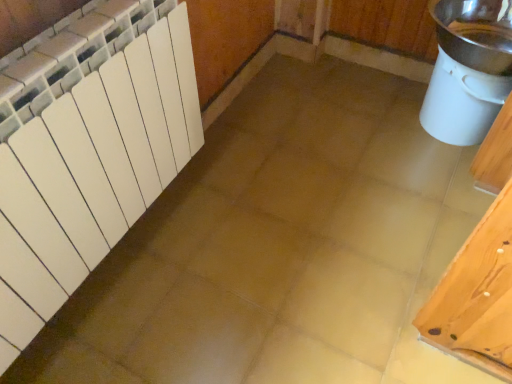
Question: In terms of height, does white matte radiator at left look taller or shorter compared to white plastic bucket at right?

Choices:
 (A) tall
 (B) short

Answer: (A)

Question: Is white matte radiator at left bigger or smaller than white plastic bucket at right?

Choices:
 (A) small
 (B) big

Answer: (B)

Question: From a real-world perspective, relative to white plastic bucket at right, is white matte radiator at left vertically above or below?

Choices:
 (A) above
 (B) below

Answer: (A)

Question: From the image's perspective, is white plastic bucket at right located above or below white matte radiator at left?

Choices:
 (A) below
 (B) above

Answer: (B)

Question: From a real-world perspective, is white plastic bucket at right positioned above or below white matte radiator at left?

Choices:
 (A) below
 (B) above

Answer: (A)

Question: Looking at the image, does white plastic bucket at right seem bigger or smaller compared to white matte radiator at left?

Choices:
 (A) small
 (B) big

Answer: (A)

Question: In terms of height, does white plastic bucket at right look taller or shorter compared to white matte radiator at left?

Choices:
 (A) short
 (B) tall

Answer: (A)